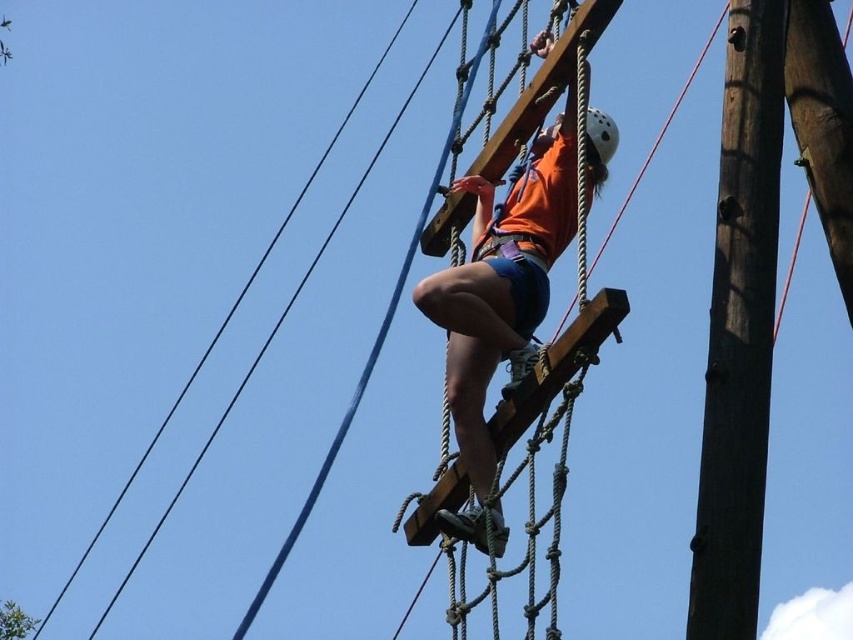
You are a safety inspector checking the rope course structure. You notice two points on the structure labeled as point (x=509, y=387) and point (x=595, y=124). Which point is positioned closer to you?

Point (x=509, y=387) is closer to the viewer than point (x=595, y=124).

You are an observer watching someone climb a rope course. You notice the brown rough wood pole at right and the orange fabric shirt at center. Which object is located to the right of the other?

The brown rough wood pole at right is positioned on the right side of orange fabric shirt at center, so the pole is to the right of the shirt.